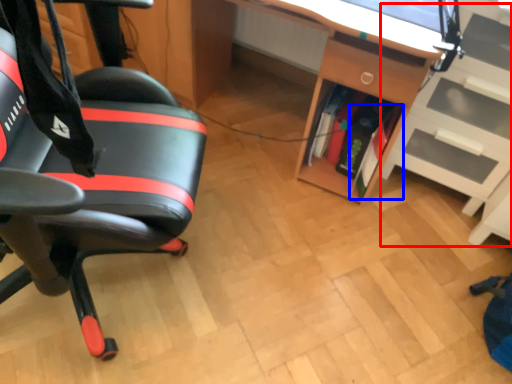
Question: Which object is closer to the camera taking this photo, shelf (highlighted by a red box) or book (highlighted by a blue box)?

Choices:
 (A) shelf
 (B) book

Answer: (A)